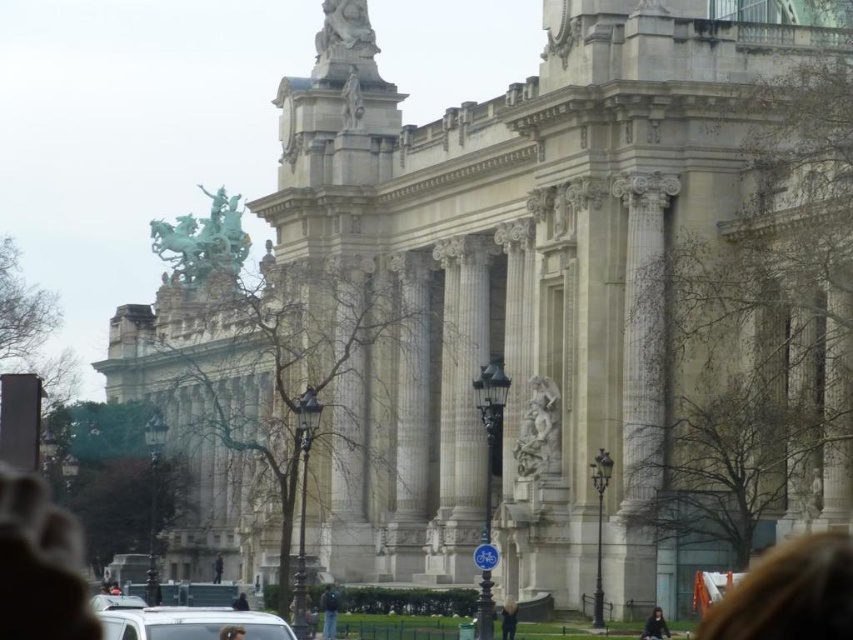
Question: From the image, what is the correct spatial relationship of white marble column at center in relation to stone statue at upper center?

Choices:
 (A) below
 (B) above

Answer: (A)

Question: Among these points, which one is nearest to the camera?

Choices:
 (A) (633, 464)
 (B) (512, 609)

Answer: (B)

Question: Based on their relative distances, which object is nearer to the dark hair at lower right?

Choices:
 (A) white marble statue at center
 (B) white marble statue at upper center
 (C) black fabric person at lower center
 (D) light brown hair at lower center

Answer: (A)

Question: Is dark hair at lower right to the left of dark blue jeans at center from the viewer's perspective?

Choices:
 (A) yes
 (B) no

Answer: (B)

Question: Is the position of white marble column at center more distant than that of dark blue jeans at center?

Choices:
 (A) yes
 (B) no

Answer: (B)

Question: Based on their relative distances, which object is farther from the white marble statue at center?

Choices:
 (A) dark hair at lower right
 (B) brown leather jacket at center
 (C) white matte van at lower center
 (D) blonde hair at lower right

Answer: (B)